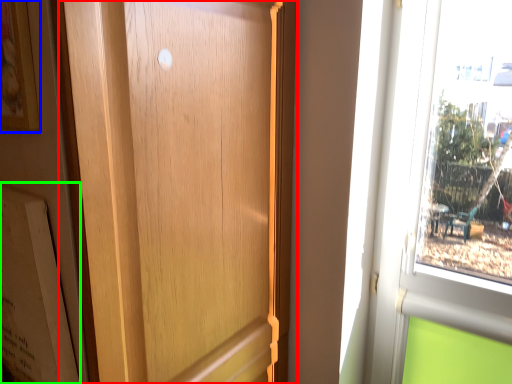
Question: Which is farther away from door (highlighted by a red box)? picture frame (highlighted by a blue box) or bulletin board (highlighted by a green box)?

Choices:
 (A) picture frame
 (B) bulletin board

Answer: (A)